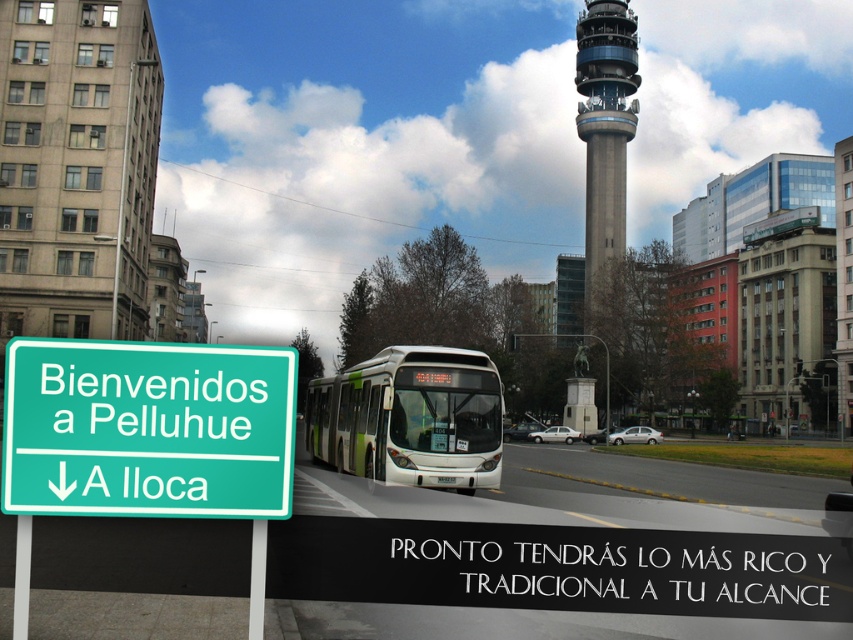
Based on the photo, you are a pedestrian standing at point (589, 208). You want to cross the road to reach point (190, 380). Is the point you want to reach in front of or behind you relative to your current position?

The point (190, 380) is in front of point (589, 208), so the destination is in front of your current position.

You are a pedestrian standing on the sidewalk next to the road. You see the green matte bus at center and the concrete tower at upper center. Which object is closer to your right side?

The concrete tower at upper center is closer to your right side because the green matte bus at center is to the left of it.